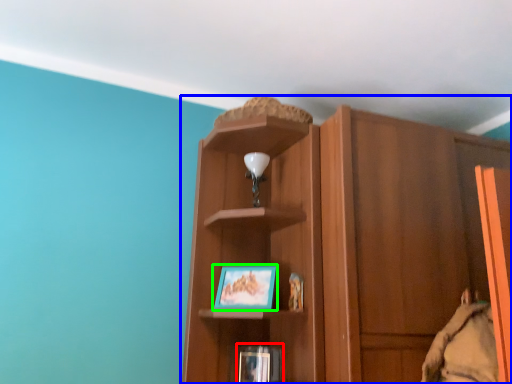
Question: Estimate the real-world distances between objects in this image. Which object is farther from book (highlighted by a red box), cupboard (highlighted by a blue box) or picture frame (highlighted by a green box)?

Choices:
 (A) cupboard
 (B) picture frame

Answer: (A)